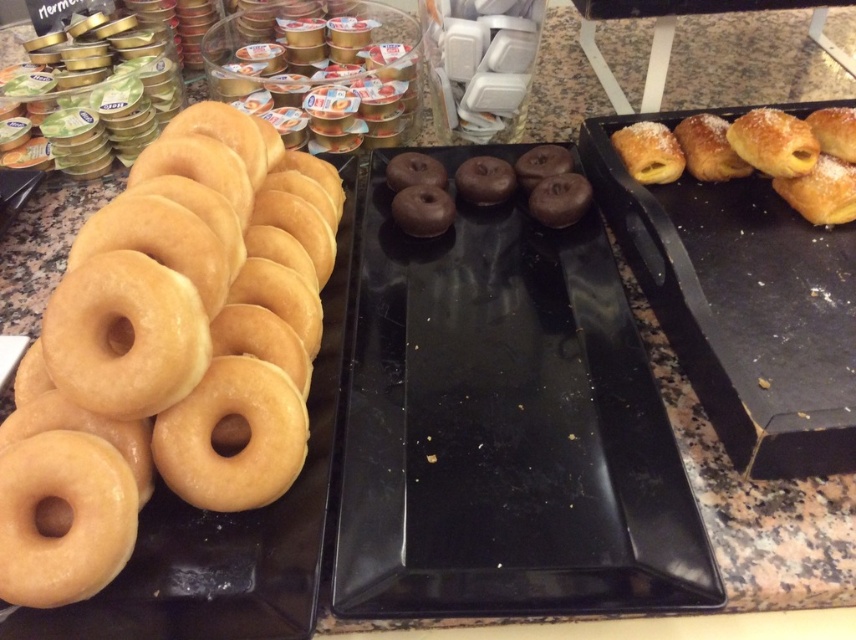
Is glossy glazed donut at left thinner than golden matte donut at left?

No.

Who is positioned more to the left, glossy glazed donut at left or golden matte donut at left?

From the viewer's perspective, golden matte donut at left appears more on the left side.

Who is more distant from viewer, (x=110, y=417) or (x=46, y=596)?

The point (x=110, y=417) is behind.

The width and height of the screenshot is (856, 640). I want to click on glossy glazed donut at left, so click(x=169, y=353).